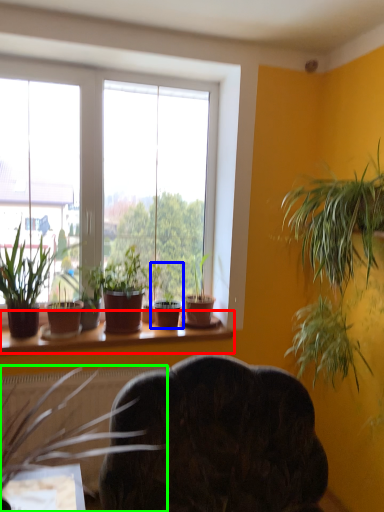
Question: Based on their relative distances, which object is farther from window sill (highlighted by a red box)? Choose from houseplant (highlighted by a blue box) and houseplant (highlighted by a green box).

Choices:
 (A) houseplant
 (B) houseplant

Answer: (B)